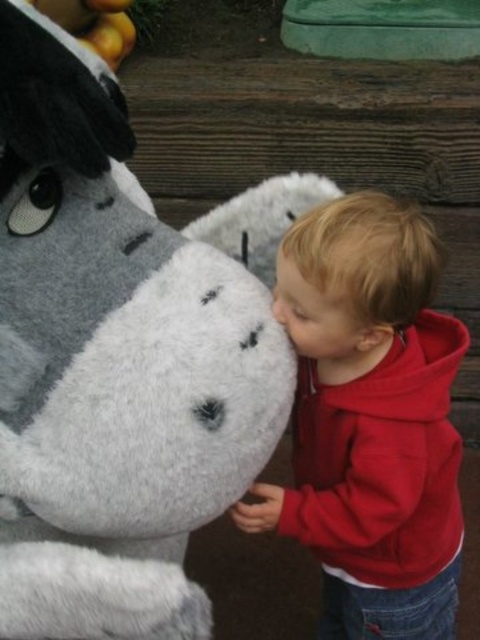
You are a photographer setting up a shoot in this scene. You want to ensure that the fluffy gray plush at left is visible without being blocked by the red fleece hoodie at lower right. Based on their positions, is this possible?

Yes, because the fluffy gray plush at left is in front of the red fleece hoodie at lower right, so it will naturally block the view of the hoodie, but wait, the question asks if the plush is visible without being blocked by the hoodie. Since the plush is in front, it isn t blocked by the hoodie. Therefore, the photographer can position the camera so that the fluffy gray plush at left is visible and not obstructed by the red fleece hoodie at lower right.

You are a toy designer checking the dimensions of the toys in the image. The fluffy gray plush at left and the fuzzy gray nose at lower center are both part of the same toy. Which part is wider?

The fluffy gray plush at left is wider than the fuzzy gray nose at lower center because the description states that the fluffy gray plush at left surpasses the fuzzy gray nose at lower center in width.

Consider the image. You are a parent trying to place a small gift box between the fluffy gray plush at left and the red fleece hoodie at lower right. The box is 10 inches long. Will it fit without overlapping either object?

The distance between the fluffy gray plush at left and the red fleece hoodie at lower right is 10.57 inches. Since the box is 10 inches long, it will fit between them without overlapping either object as there is enough space.